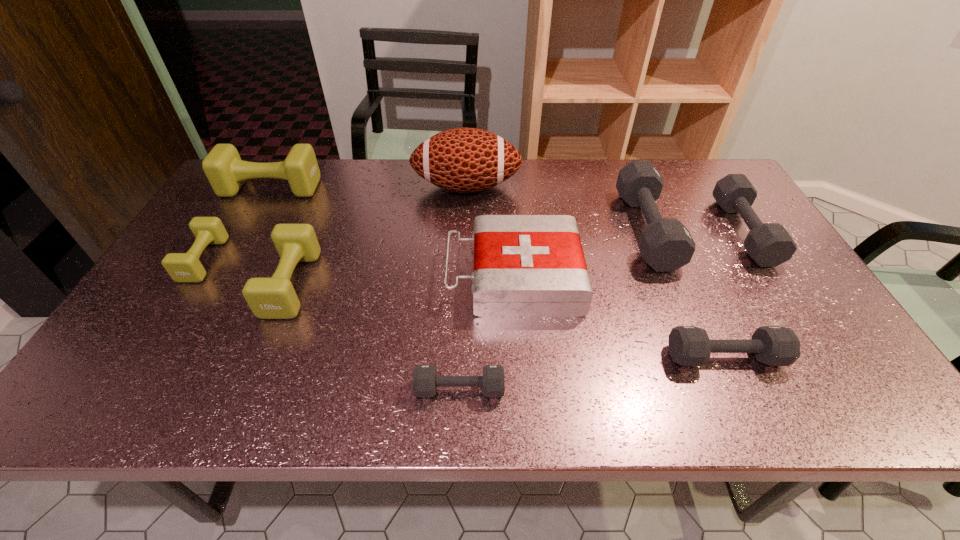
At what (x,y) coordinates should I click in order to perform the action: click on vacant space that satisfies the following two spatial constraints: 1. on the front side of the shortest object; 2. on the right side of the smallest olive dumbbell. Please return your answer as a coordinate pair (x, y). The image size is (960, 540). Looking at the image, I should click on (123, 389).

Image resolution: width=960 pixels, height=540 pixels. I want to click on free space that satisfies the following two spatial constraints: 1. on the back side of the second biggest gray dumbbell; 2. on the right side of the smallest olive dumbbell, so click(222, 232).